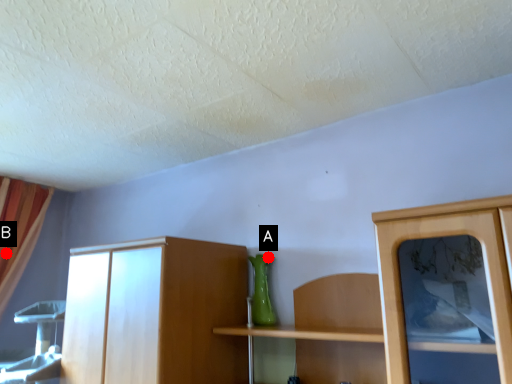
Question: Two points are circled on the image, labeled by A and B beside each circle. Which point is closer to the camera?

Choices:
 (A) A is closer
 (B) B is closer

Answer: (A)